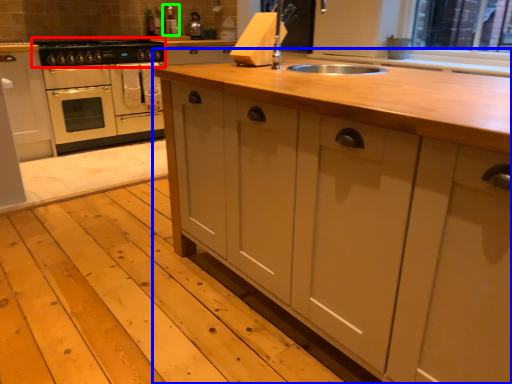
Question: Which is nearer to the gas stove (highlighted by a red box)? countertop (highlighted by a blue box) or appliance (highlighted by a green box).

Choices:
 (A) countertop
 (B) appliance

Answer: (B)